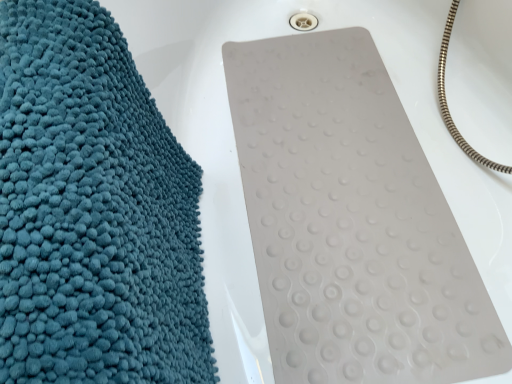
Question: Is teal fluffy towel at left taller or shorter than white rubber mat at center?

Choices:
 (A) short
 (B) tall

Answer: (B)

Question: Based on their sizes in the image, would you say teal fluffy towel at left is bigger or smaller than white rubber mat at center?

Choices:
 (A) small
 (B) big

Answer: (B)

Question: Looking at their shapes, would you say teal fluffy towel at left is wider or thinner than white rubber mat at center?

Choices:
 (A) wide
 (B) thin

Answer: (B)

Question: Looking at their shapes, would you say white rubber mat at center is wider or thinner than teal fluffy towel at left?

Choices:
 (A) thin
 (B) wide

Answer: (B)

Question: From their relative heights in the image, would you say white rubber mat at center is taller or shorter than teal fluffy towel at left?

Choices:
 (A) tall
 (B) short

Answer: (B)

Question: Relative to teal fluffy towel at left, is white rubber mat at center in front or behind?

Choices:
 (A) behind
 (B) front

Answer: (A)

Question: From a real-world perspective, is white rubber mat at center above or below teal fluffy towel at left?

Choices:
 (A) below
 (B) above

Answer: (A)